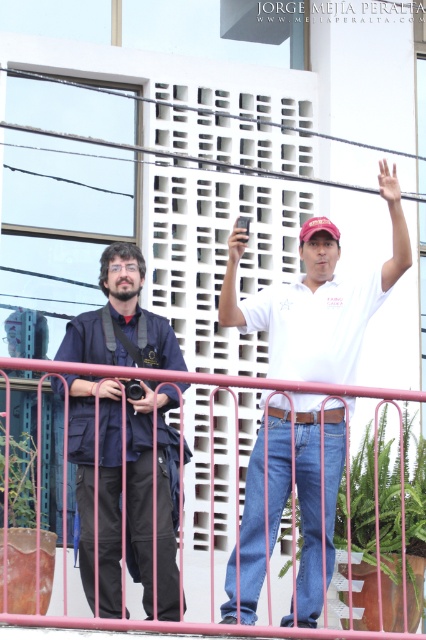
In the scene shown: Can you confirm if white cotton shirt at center is wider than pink metal fence at lower center?

No, white cotton shirt at center is not wider than pink metal fence at lower center.

The width and height of the screenshot is (426, 640). What do you see at coordinates (317, 298) in the screenshot? I see `white cotton shirt at center` at bounding box center [317, 298].

Between point (244, 547) and point (5, 618), which one is positioned in front?

Point (5, 618)

The image size is (426, 640). I want to click on white cotton shirt at center, so click(317, 298).

Can you confirm if white cotton shirt at center is positioned to the left of dark blue fabric jacket at left?

No, white cotton shirt at center is not to the left of dark blue fabric jacket at left.

Who is taller, white cotton shirt at center or dark blue fabric jacket at left?

white cotton shirt at center

What do you see at coordinates (317, 298) in the screenshot?
I see `white cotton shirt at center` at bounding box center [317, 298].

I want to click on white cotton shirt at center, so coord(317,298).

Who is positioned more to the left, dark blue fabric jacket at left or pink metal fence at lower center?

dark blue fabric jacket at left is more to the left.

This screenshot has height=640, width=426. Identify the location of dark blue fabric jacket at left. (121, 321).

I want to click on dark blue fabric jacket at left, so click(x=121, y=321).